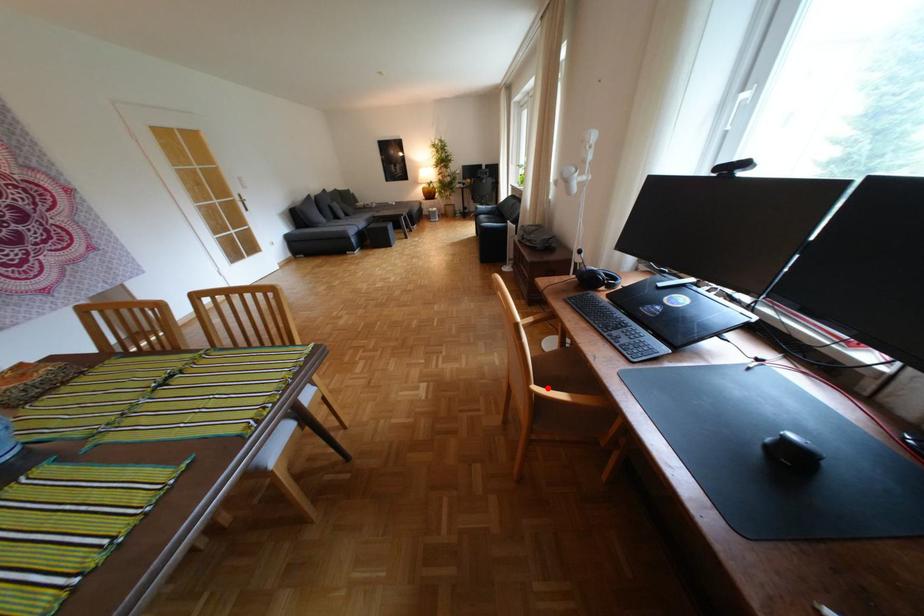
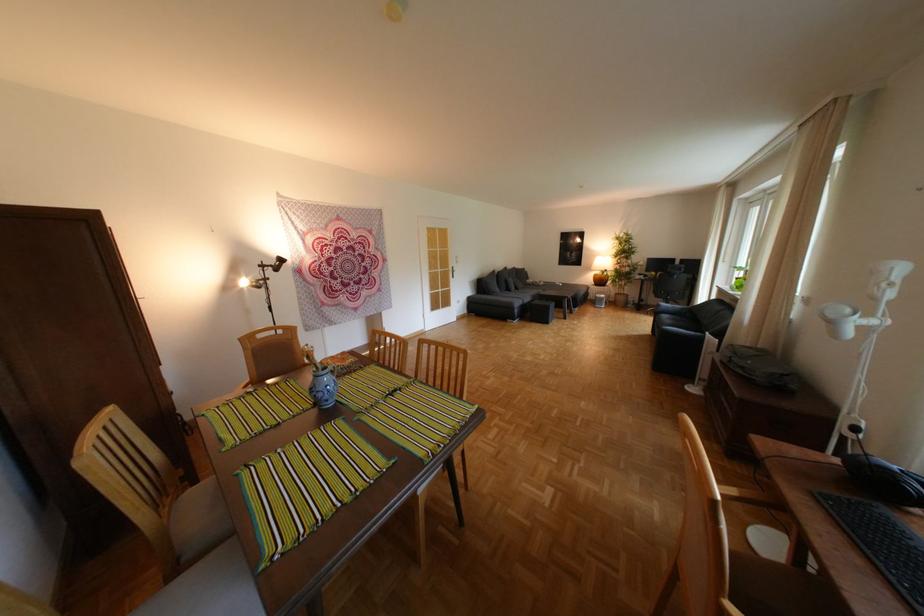
The point at the highlighted location is marked in the first image. Where is the corresponding point in the second image?

(744, 608)